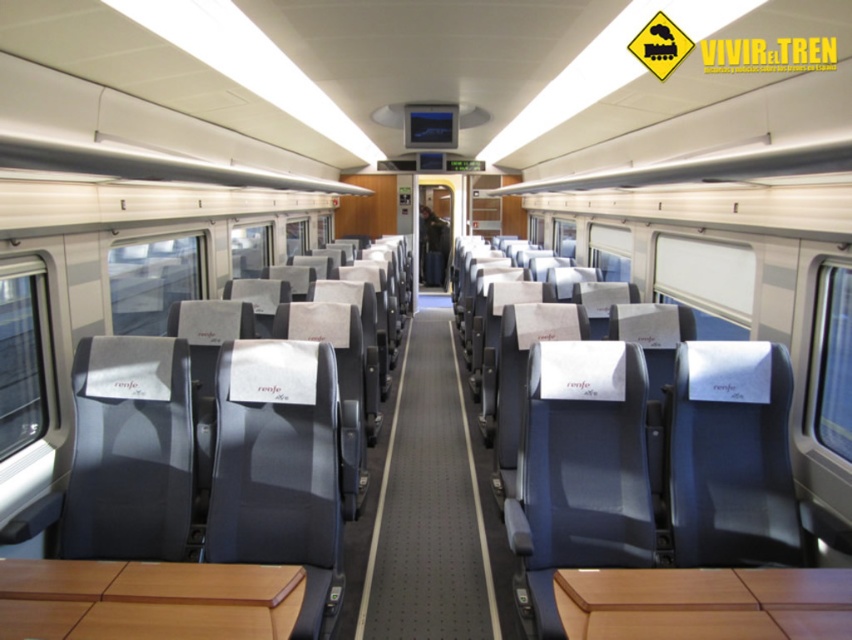
Is gray carpet at center taller than matte gray seat at center?

Incorrect, gray carpet at center's height is not larger of matte gray seat at center's.

Who is shorter, gray carpet at center or matte gray seat at center?

gray carpet at center is shorter.

Does point (482, 536) come behind point (430, 221)?

No, it is in front of (430, 221).

Identify the location of gray carpet at center. Image resolution: width=852 pixels, height=640 pixels. (429, 506).